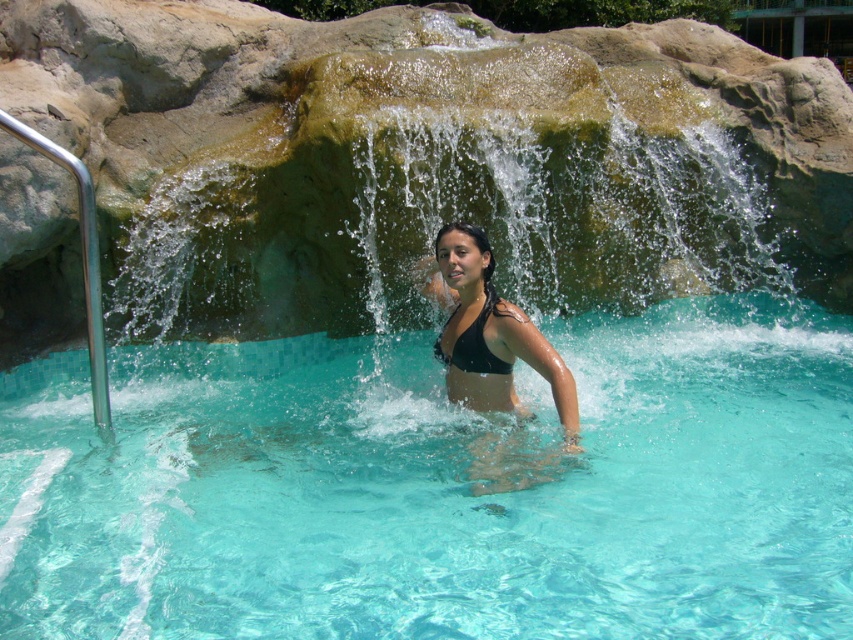
Question: Which of the following is the closest to the observer?

Choices:
 (A) (473, 342)
 (B) (225, 616)
 (C) (503, 488)

Answer: (B)

Question: Is clear glass swimming pool at center positioned in front of black matte bikini at center?

Choices:
 (A) no
 (B) yes

Answer: (B)

Question: Can you confirm if black matte bikini at center is thinner than black matte bikini top at center?

Choices:
 (A) yes
 (B) no

Answer: (B)

Question: Does clear glass swimming pool at center have a greater width compared to black matte bikini top at center?

Choices:
 (A) no
 (B) yes

Answer: (B)

Question: Which object is farther from the camera taking this photo?

Choices:
 (A) clear glass swimming pool at center
 (B) black matte bikini top at center
 (C) black matte bikini at center

Answer: (B)

Question: Which of the following is the farthest from the observer?

Choices:
 (A) (424, 401)
 (B) (558, 355)

Answer: (A)